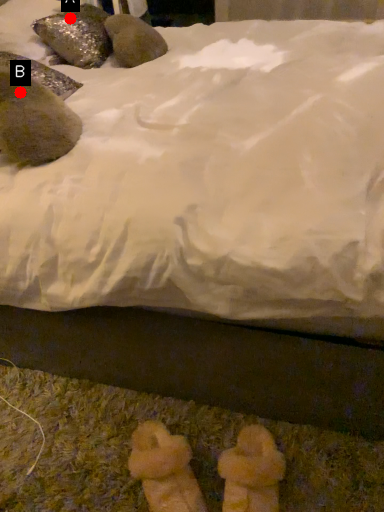
Question: Two points are circled on the image, labeled by A and B beside each circle. Among these points, which one is farthest from the camera?

Choices:
 (A) A is further
 (B) B is further

Answer: (A)